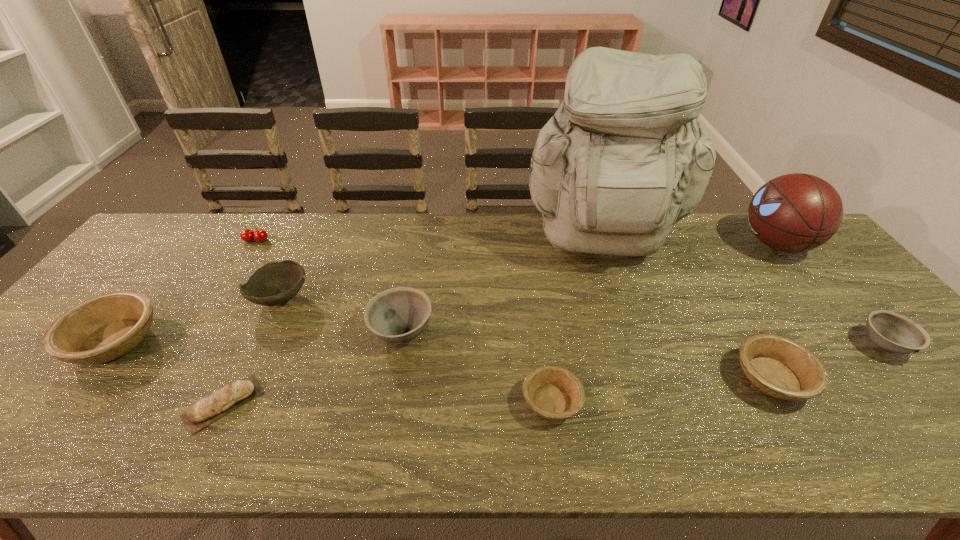
The image size is (960, 540). In order to click on the tallest object in this screenshot , I will do `click(623, 159)`.

Where is `basketball`? basketball is located at coordinates (797, 212).

Identify the location of the third tallest object. This screenshot has height=540, width=960. (247, 235).

I want to click on the second object from left to right, so (247, 235).

Where is `the left gray bowl`? This screenshot has height=540, width=960. the left gray bowl is located at coordinates (400, 314).

The height and width of the screenshot is (540, 960). In order to click on the fifth object from left to right in this screenshot , I will do `click(400, 314)`.

The width and height of the screenshot is (960, 540). I want to click on the fifth bowl from right to left, so click(275, 283).

Image resolution: width=960 pixels, height=540 pixels. What are the coordinates of `the biggest beige bowl` in the screenshot? It's located at (103, 328).

Find the location of a particular element. This screenshot has width=960, height=540. the leftmost bowl is located at coordinates [103, 328].

You are a GUI agent. You are given a task and a screenshot of the screen. Output one action in this format:
    pyautogui.click(x=<x>, y=<y>)
    Task: Click on the smaller gray bowl
    
    Given the screenshot: What is the action you would take?
    pyautogui.click(x=893, y=332)